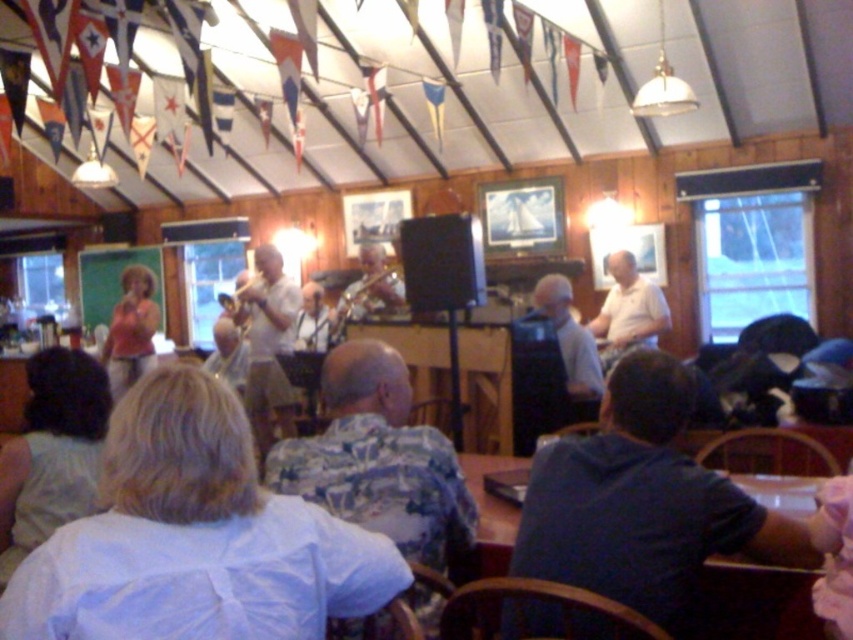
Question: In this image, where is floral shirt at center located relative to shiny brass trumpet at center?

Choices:
 (A) above
 (B) below

Answer: (B)

Question: Does dark blue shirt at lower right come behind matte pink blouse at left?

Choices:
 (A) yes
 (B) no

Answer: (B)

Question: Among these objects, which one is farthest from the camera?

Choices:
 (A) dark blue shirt at lower right
 (B) light blue fabric dress at lower left

Answer: (B)

Question: Which point is farther to the camera?

Choices:
 (A) (692, 532)
 (B) (7, 550)

Answer: (B)

Question: Among these points, which one is nearest to the camera?

Choices:
 (A) pyautogui.click(x=231, y=413)
 (B) pyautogui.click(x=254, y=337)

Answer: (A)

Question: Does white matte shirt at center come behind light blue shirt at center?

Choices:
 (A) no
 (B) yes

Answer: (B)